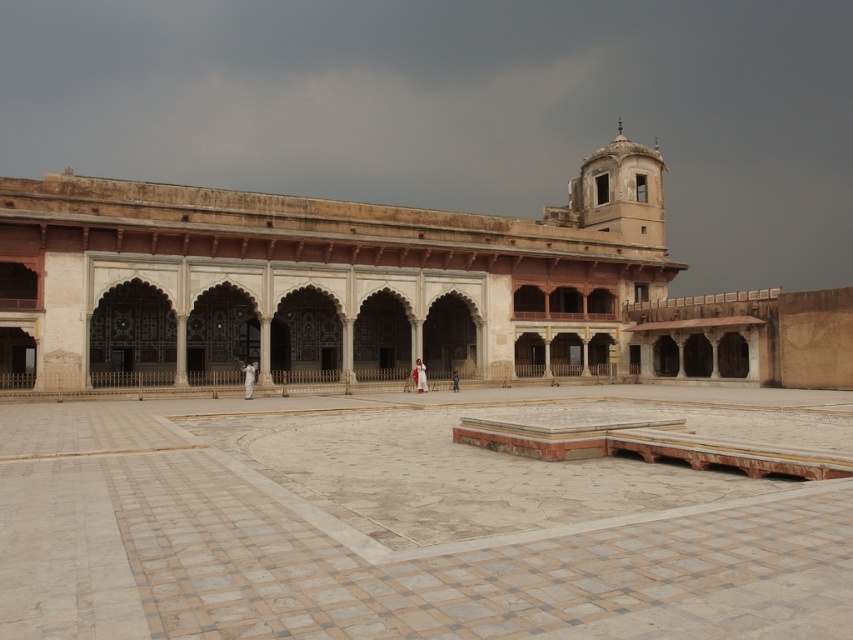
Is white marble courtyard at center thinner than beige stone palace at center?

Correct, white marble courtyard at center's width is less than beige stone palace at center's.

Is point (51, 432) positioned before point (515, 243)?

Yes.

This screenshot has width=853, height=640. I want to click on white marble courtyard at center, so click(x=413, y=520).